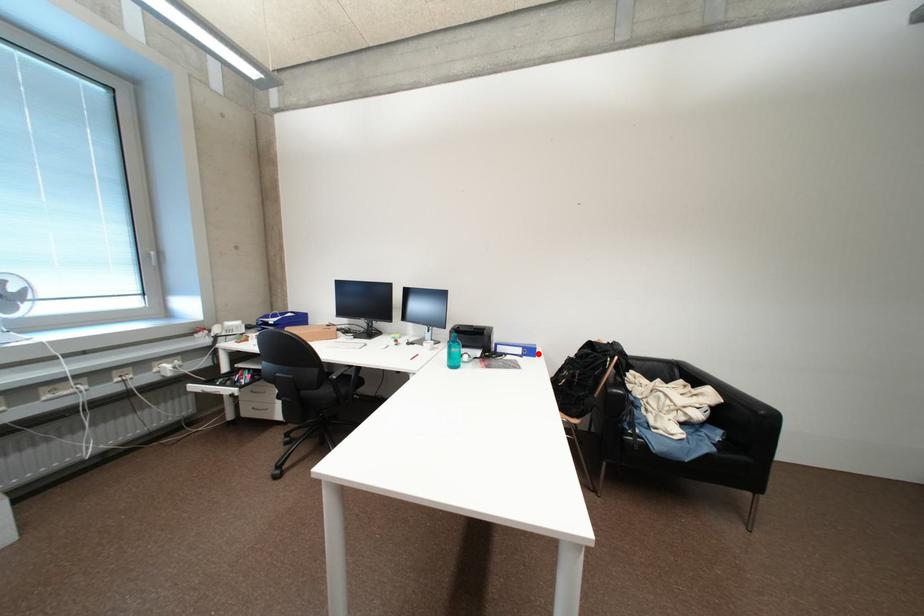
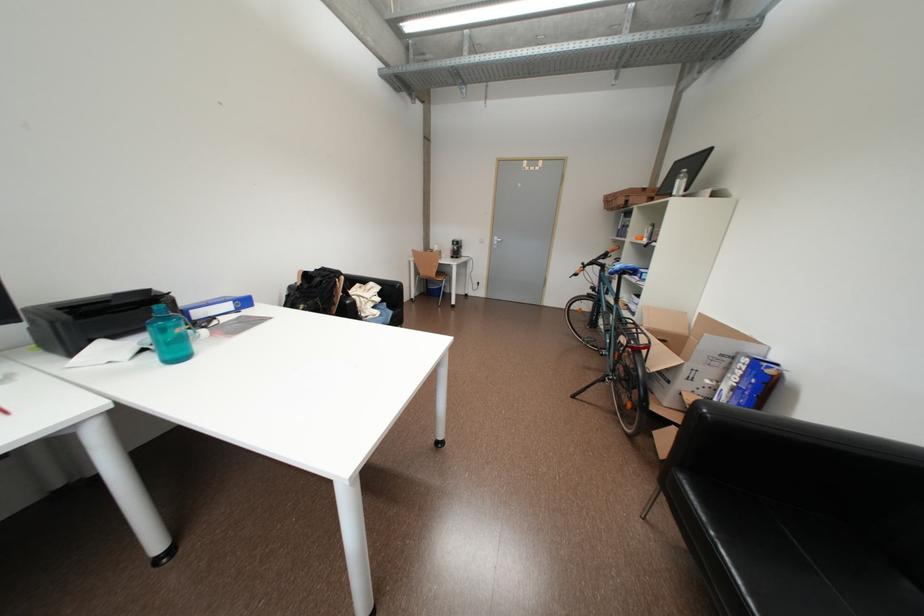
Question: I am providing you with two images of the same scene from different viewpoints. In image1, a red point is highlighted. Considering the same 3D point in image2, which of the following is correct?

Choices:
 (A) It is closer
 (B) It is farther

Answer: (A)